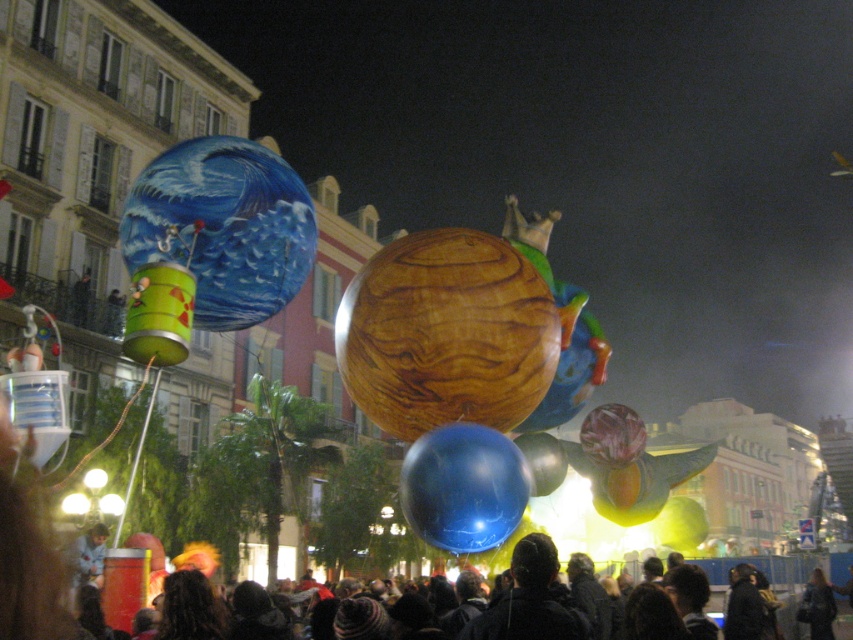
Question: Does wooden sphere at center have a larger size compared to glossy blue balloon at center?

Choices:
 (A) no
 (B) yes

Answer: (B)

Question: Can you confirm if glossy blue balloon at center is bigger than dark blue jacket at center?

Choices:
 (A) no
 (B) yes

Answer: (A)

Question: Does shiny metallic balloon at upper left have a smaller size compared to dark blue jacket at center?

Choices:
 (A) yes
 (B) no

Answer: (B)

Question: Among these objects, which one is farthest from the camera?

Choices:
 (A) wooden sphere at center
 (B) dark hair at lower center
 (C) shiny metallic balloon at upper left

Answer: (B)

Question: Which object is the farthest from the glossy blue balloon at center?

Choices:
 (A) dark blue jacket at center
 (B) wooden sphere at center

Answer: (A)

Question: Which point is farther to the camera?

Choices:
 (A) dark blue jacket at center
 (B) dark hair at lower center

Answer: (B)